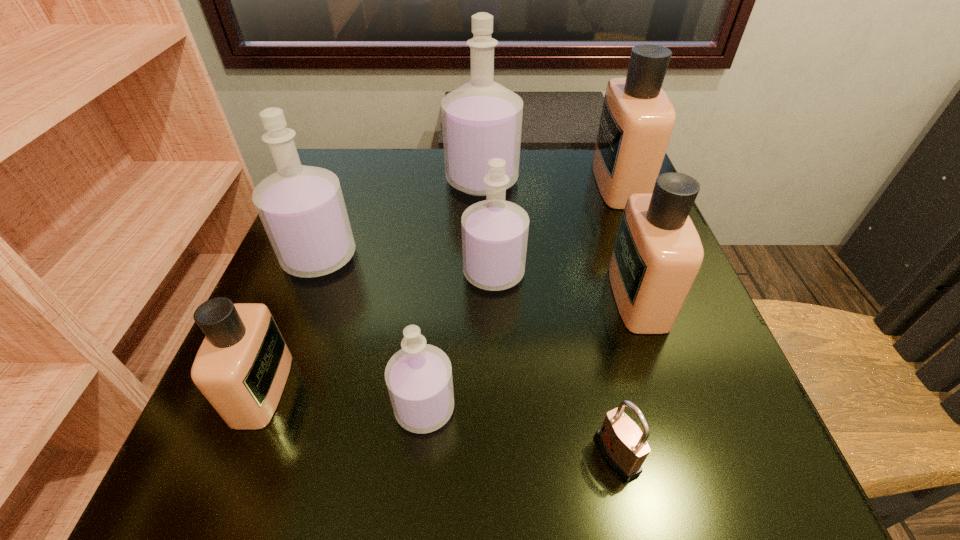
Where is `vacant position at the far right corner of the desktop`? The width and height of the screenshot is (960, 540). vacant position at the far right corner of the desktop is located at coordinates (581, 186).

You are a GUI agent. You are given a task and a screenshot of the screen. Output one action in this format:
    pyautogui.click(x=<x>, y=<y>)
    Task: Click on the free point between the padlock and the second nearest beige perfume
    This screenshot has width=960, height=540.
    Given the screenshot: What is the action you would take?
    pyautogui.click(x=627, y=375)

At what (x,y) coordinates should I click in order to perform the action: click on free space that is in between the nearest purple perfume and the leftmost purple perfume. Please return your answer as a coordinate pair (x, y). Looking at the image, I should click on (372, 332).

Where is `blank region between the tallest object and the leftmost purple perfume`? The height and width of the screenshot is (540, 960). blank region between the tallest object and the leftmost purple perfume is located at coordinates (400, 218).

Identify the location of empty space between the padlock and the leftmost purple perfume. (468, 355).

Find the location of a particular element. vacant region between the padlock and the second biggest beige perfume is located at coordinates (627, 375).

This screenshot has height=540, width=960. Find the location of `vacant point located between the sixth object from left to right and the farthest beige perfume`. vacant point located between the sixth object from left to right and the farthest beige perfume is located at coordinates (618, 319).

The height and width of the screenshot is (540, 960). Find the location of `empty location between the second nearest beige perfume and the tallest object`. empty location between the second nearest beige perfume and the tallest object is located at coordinates (560, 238).

Image resolution: width=960 pixels, height=540 pixels. Find the location of `free spot between the second nearest beige perfume and the second smallest purple perfume`. free spot between the second nearest beige perfume and the second smallest purple perfume is located at coordinates (565, 285).

At what (x,y) coordinates should I click in order to perform the action: click on unoccupied position between the smallest purple perfume and the biggest purple perfume. Please return your answer as a coordinate pair (x, y). Looking at the image, I should click on (453, 294).